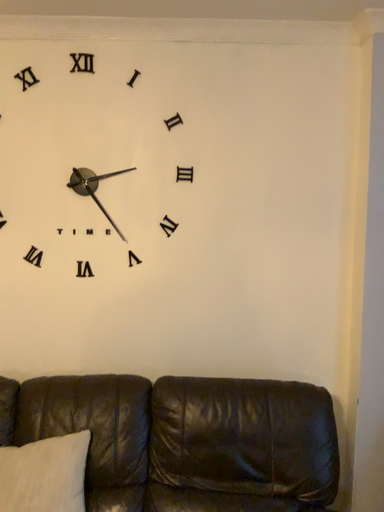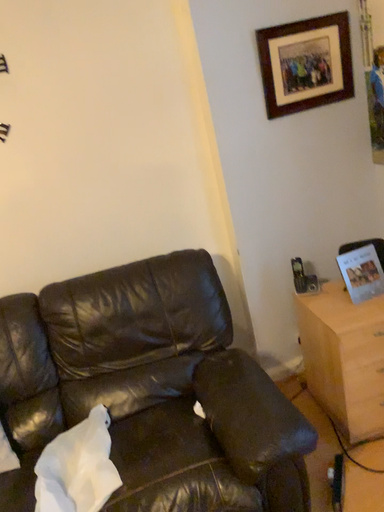
Question: Which way did the camera rotate in the video?

Choices:
 (A) rotated right
 (B) rotated left

Answer: (A)